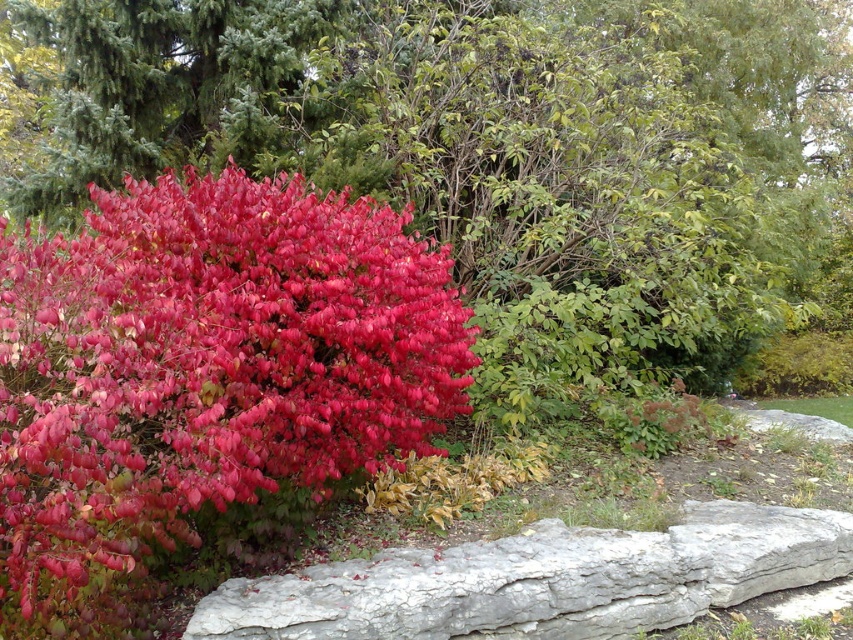
You are standing in the garden and want to take a photo of the red bush. The camera you are using has a focus range of 8 to 10 feet. Can you focus on the point at coordinates point (200, 474) without adjusting your position?

The distance of point (200, 474) from the camera is 9.28 feet, which falls within the camera focus range of 8 to 10 feet. Therefore, you can focus on the point (200, 474) without adjusting your position.